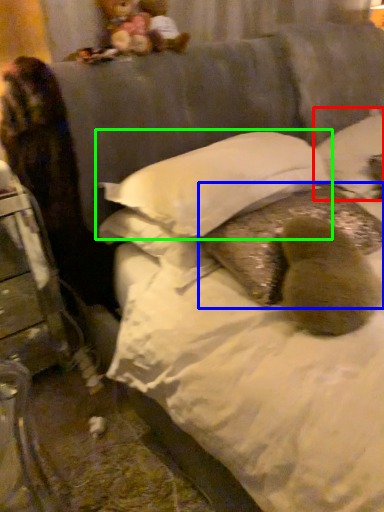
Question: Which is farther away from pillow (highlighted by a red box)? pillow (highlighted by a blue box) or pillow (highlighted by a green box)?

Choices:
 (A) pillow
 (B) pillow

Answer: (B)